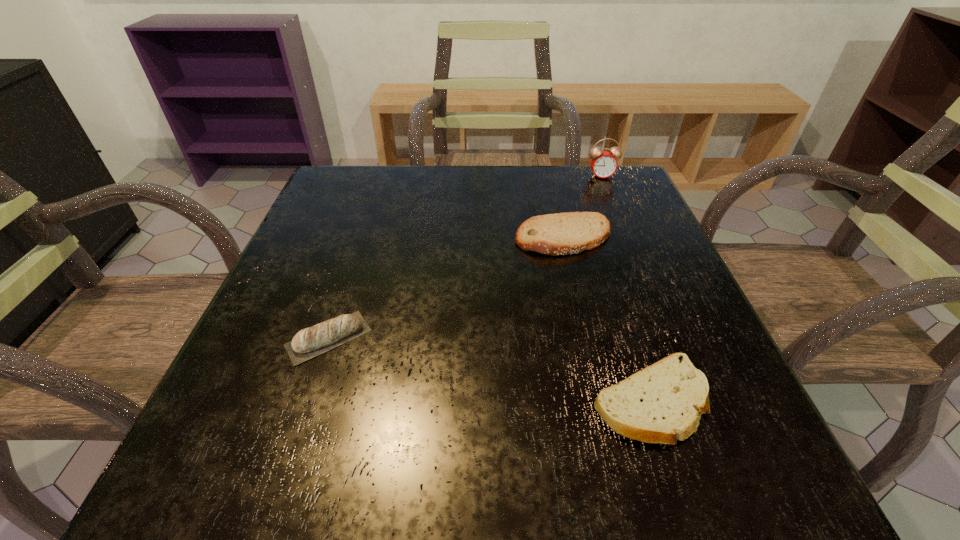
Identify the location of object identified as the second closest to the third nearest object. This screenshot has width=960, height=540. (659, 404).

Image resolution: width=960 pixels, height=540 pixels. I want to click on the third closest object to the tallest object, so click(x=310, y=342).

Image resolution: width=960 pixels, height=540 pixels. Find the location of `pita bread that is the closest to the alarm clock`. pita bread that is the closest to the alarm clock is located at coordinates (567, 233).

Locate an element on the screen. The width and height of the screenshot is (960, 540). the second closest pita bread to the leftmost pita bread is located at coordinates (659, 404).

Where is `vacant point that satisfies the following two spatial constraints: 1. on the front side of the shortest object; 2. on the left side of the farthest pita bread`? The width and height of the screenshot is (960, 540). vacant point that satisfies the following two spatial constraints: 1. on the front side of the shortest object; 2. on the left side of the farthest pita bread is located at coordinates (602, 401).